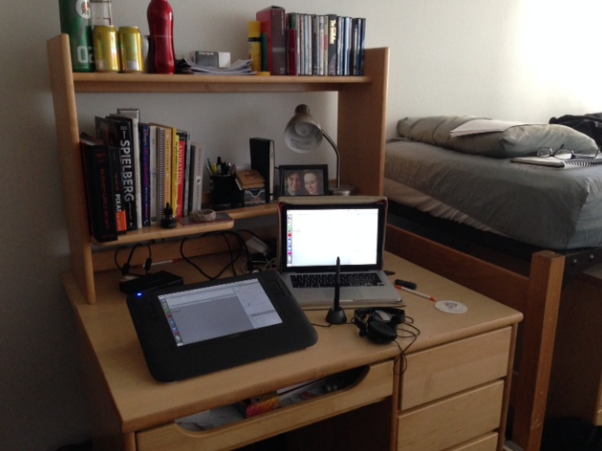
This screenshot has width=602, height=451. In order to click on wall in this screenshot , I will do `click(42, 314)`.